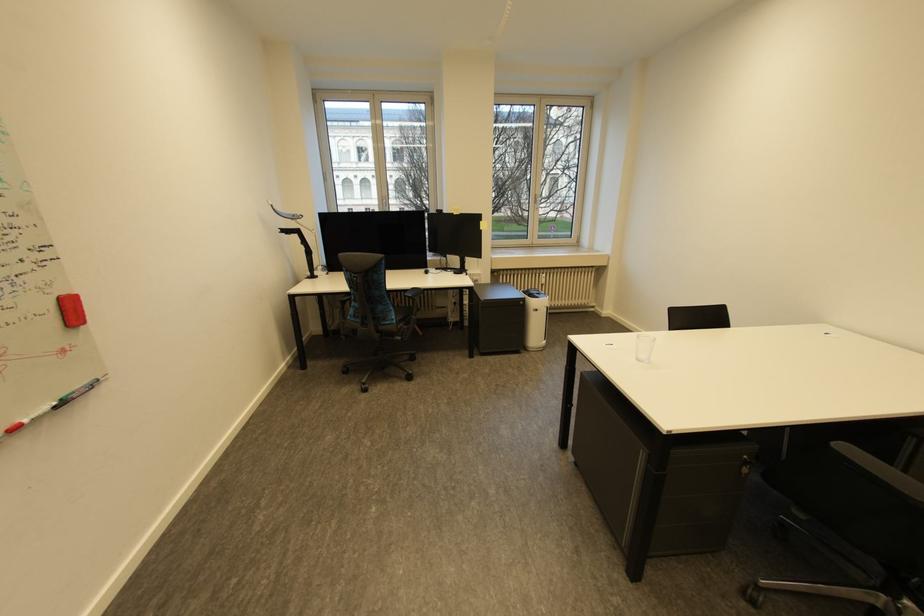
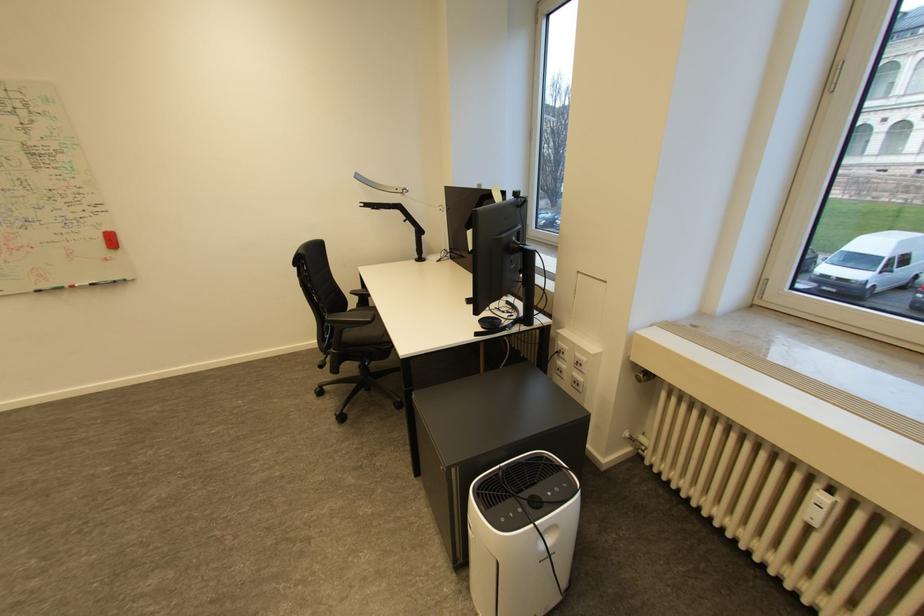
Locate, in the second image, the point that corresponds to (32,422) in the first image.

(83, 286)